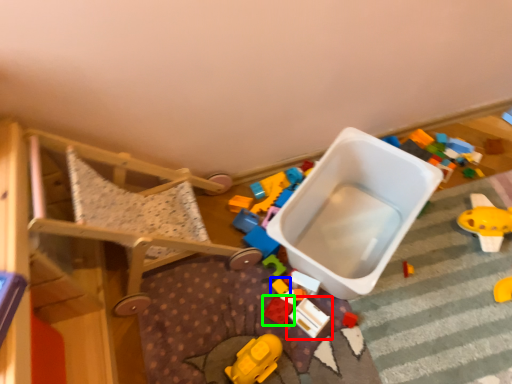
Question: Which is nearer to the toy (highlighted by a red box)? toy (highlighted by a blue box) or toy (highlighted by a green box).

Choices:
 (A) toy
 (B) toy

Answer: (B)